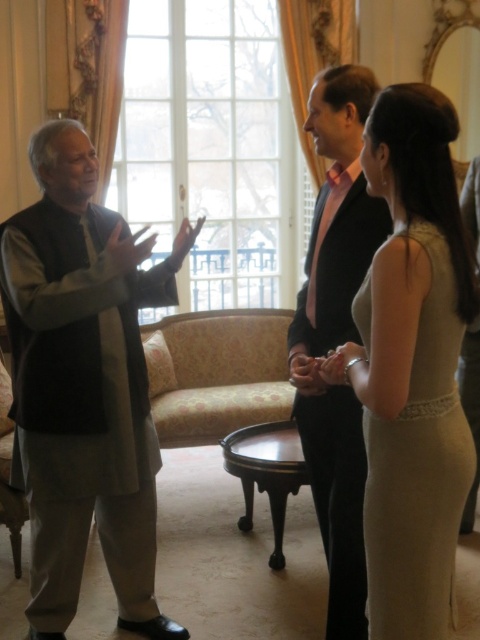
Question: Does matte black suit at center come in front of satin beige dress at right?

Choices:
 (A) yes
 (B) no

Answer: (B)

Question: Estimate the real-world distances between objects in this image. Which object is closer to the satin beige dress at right?

Choices:
 (A) matte gray vest at left
 (B) matte black suit at center

Answer: (B)

Question: Among these points, which one is nearest to the camera?

Choices:
 (A) (331, 109)
 (B) (92, 218)
 (C) (455, 372)

Answer: (C)

Question: Does matte gray vest at left have a lesser width compared to matte black suit at center?

Choices:
 (A) yes
 (B) no

Answer: (B)

Question: Is matte black suit at center to the right of satin beige dress at right from the viewer's perspective?

Choices:
 (A) yes
 (B) no

Answer: (B)

Question: Estimate the real-world distances between objects in this image. Which object is farther from the matte gray vest at left?

Choices:
 (A) matte black suit at center
 (B) satin beige dress at right

Answer: (B)